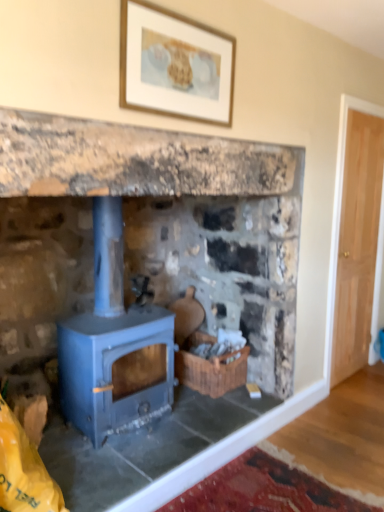
Question: Considering the positions of point (41, 138) and point (196, 375), is point (41, 138) closer or farther from the camera than point (196, 375)?

Choices:
 (A) farther
 (B) closer

Answer: (B)

Question: From their relative heights in the image, would you say blue matte wood stove at center is taller or shorter than woven brown basket at center?

Choices:
 (A) tall
 (B) short

Answer: (A)

Question: Estimate the real-world distances between objects in this image. Which object is closer to the woven brown basket at center?

Choices:
 (A) blue matte wood stove at center
 (B) blue matte wood burning stove at center
 (C) wooden framed artwork at upper center

Answer: (A)

Question: Estimate the real-world distances between objects in this image. Which object is closer to the blue matte wood stove at center?

Choices:
 (A) blue matte wood burning stove at center
 (B) wooden framed artwork at upper center
 (C) woven brown basket at center

Answer: (A)